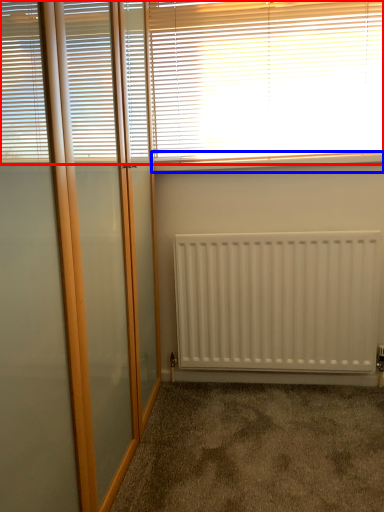
Question: Which object appears closest to the camera in this image, window blind (highlighted by a red box) or window sill (highlighted by a blue box)?

Choices:
 (A) window blind
 (B) window sill

Answer: (A)